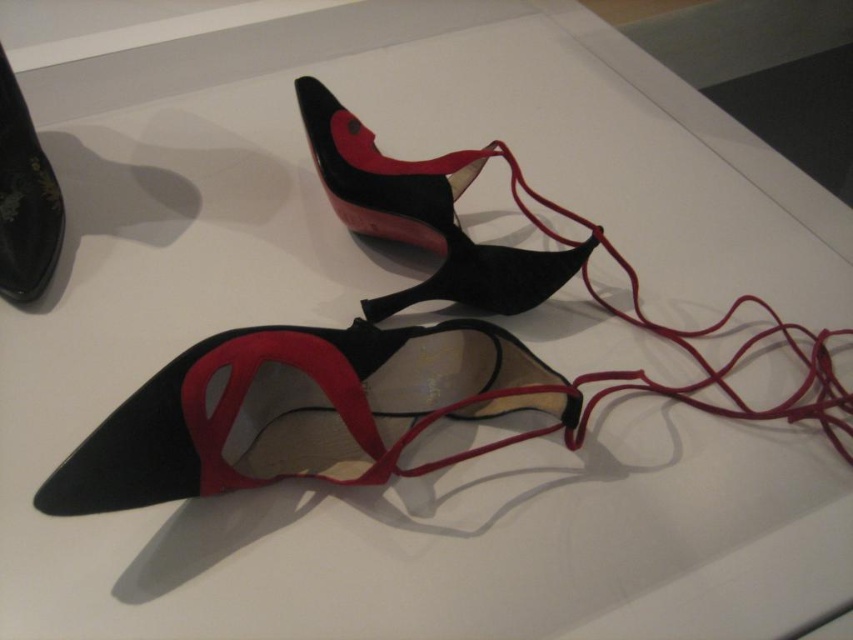
Question: Can you confirm if suede/black high-heeled shoe at center is thinner than black suede shoe at left?

Choices:
 (A) no
 (B) yes

Answer: (A)

Question: Which object is positioned farthest from the suede/black high-heeled shoe at center?

Choices:
 (A) satin red shoe lace at center
 (B) black suede shoe at left
 (C) matte black high-heeled shoe at center

Answer: (B)

Question: Estimate the real-world distances between objects in this image. Which object is farther from the black suede shoe at left?

Choices:
 (A) suede/black high-heeled shoe at center
 (B) satin red shoe lace at center
 (C) matte black high-heeled shoe at center

Answer: (B)

Question: Is suede/black high-heeled shoe at center to the right of satin red shoe lace at center from the viewer's perspective?

Choices:
 (A) no
 (B) yes

Answer: (A)

Question: Is suede/black high-heeled shoe at center thinner than matte black high-heeled shoe at center?

Choices:
 (A) no
 (B) yes

Answer: (A)

Question: Which point appears closest to the camera in this image?

Choices:
 (A) (572, 273)
 (B) (50, 275)

Answer: (B)